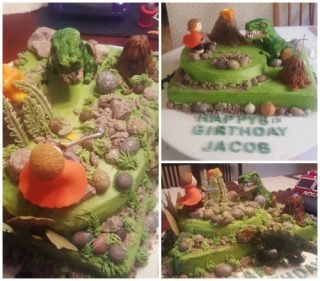
Where is `boy figurine`? Image resolution: width=320 pixels, height=281 pixels. boy figurine is located at coordinates (192, 37).